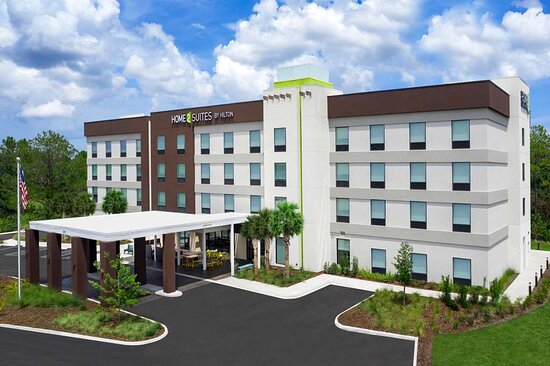
Where is `ground floor window`? The height and width of the screenshot is (366, 550). ground floor window is located at coordinates (456, 270), (422, 269), (380, 265), (348, 252), (284, 253).